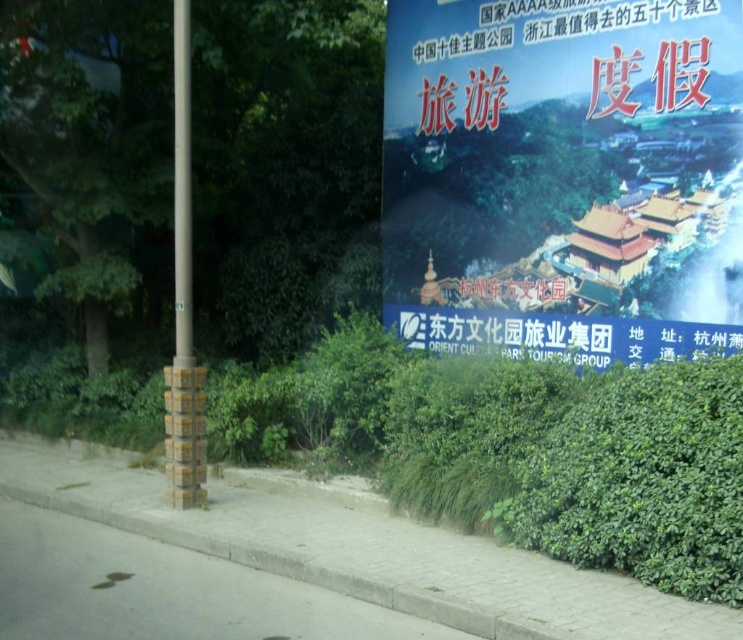
You are a photographer standing in front of the billboard and notice a white paper at center and a yellow painted metal pole at left. Which object is nearer to you?

The white paper at center is closer to the viewer than the yellow painted metal pole at left.

You are a pedestrian standing on the gray concrete pavement at lower center and want to walk to the yellow painted metal pole at left. Which direction should you move to reach the pole?

The gray concrete pavement at lower center is smaller in size than the yellow painted metal pole at left, so you should move towards the left direction to reach the yellow painted metal pole at left.